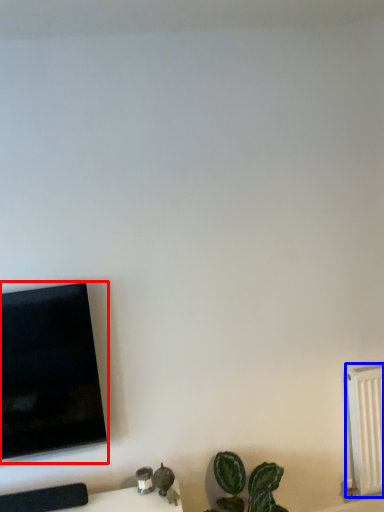
Question: Which of the following is the closest to the observer, television (highlighted by a red box) or radiator (highlighted by a blue box)?

Choices:
 (A) television
 (B) radiator

Answer: (A)